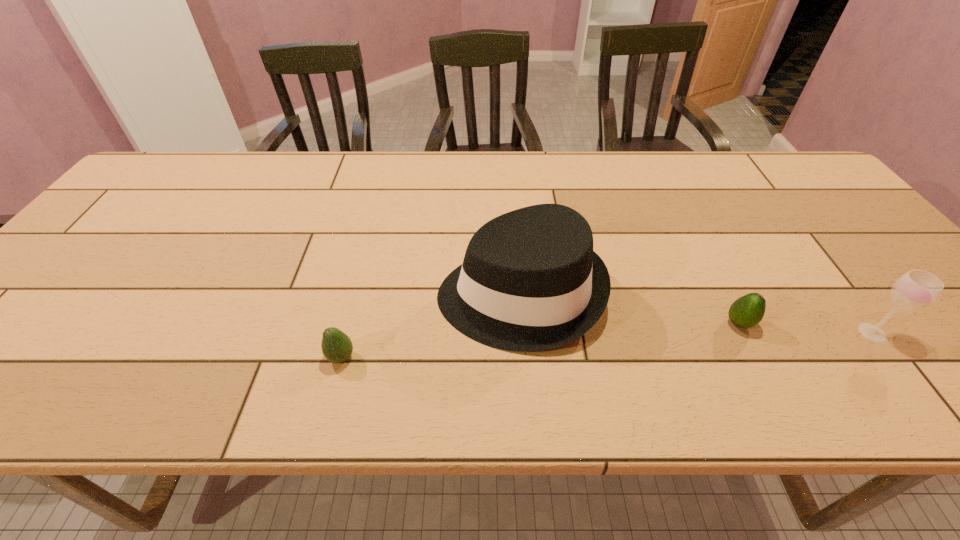
What are the coordinates of `empty location between the tallest object and the third object from left to right` in the screenshot? It's located at (630, 309).

You are a GUI agent. You are given a task and a screenshot of the screen. Output one action in this format:
    pyautogui.click(x=<x>, y=<y>)
    Task: Click on the free space between the wineglass and the tallest object
    The image size is (960, 540).
    Given the screenshot: What is the action you would take?
    pyautogui.click(x=696, y=314)

Locate an element on the screen. The width and height of the screenshot is (960, 540). vacant area that lies between the second object from left to right and the wineglass is located at coordinates (696, 314).

The height and width of the screenshot is (540, 960). Identify the location of free space between the farther avocado and the wineglass. (805, 328).

The height and width of the screenshot is (540, 960). What are the coordinates of `empty space between the third shortest object and the third object from right to left` in the screenshot? It's located at (696, 314).

At what (x,y) coordinates should I click in order to perform the action: click on free point between the fedora and the farther avocado. Please return your answer as a coordinate pair (x, y). Looking at the image, I should click on (630, 309).

Identify which object is located as the nearest to the third object from left to right. Please provide its 2D coordinates. Your answer should be formatted as a tuple, i.e. [(x, y)], where the tuple contains the x and y coordinates of a point satisfying the conditions above.

[(916, 289)]

The image size is (960, 540). I want to click on the closest object to the tallest object, so click(x=337, y=347).

At what (x,y) coordinates should I click in order to perform the action: click on vacant area in the image that satisfies the following two spatial constraints: 1. on the back side of the tallest object; 2. on the right side of the nearer avocado. Please return your answer as a coordinate pair (x, y). The image size is (960, 540). Looking at the image, I should click on (357, 294).

I want to click on free space that satisfies the following two spatial constraints: 1. on the front side of the rightmost object; 2. on the right side of the farther avocado, so click(x=744, y=333).